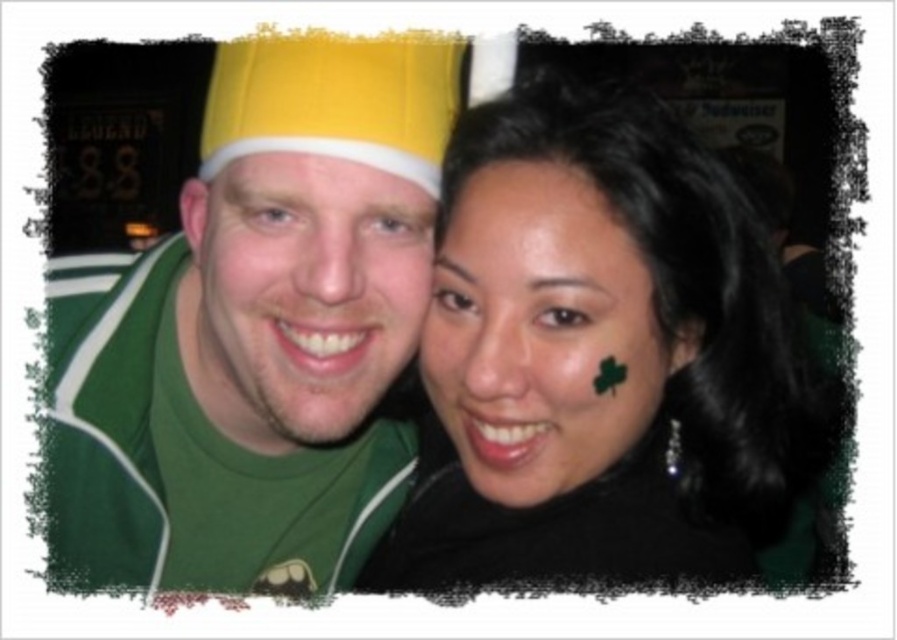
Based on the photo, you are taking a photo of two people standing in front of you. You notice two points marked in the image. One is at point [540,467] and the other at point [356,49]. Which point is closer to your camera?

Point [540,467] is further to the camera than point [356,49], so the point at [356,49] is closer to the camera.

You are standing in front of the photograph and want to know how far the yellow fabric hat at upper left is from you. Can you determine the distance?

The yellow fabric hat at upper left is 27.51 inches away from you.